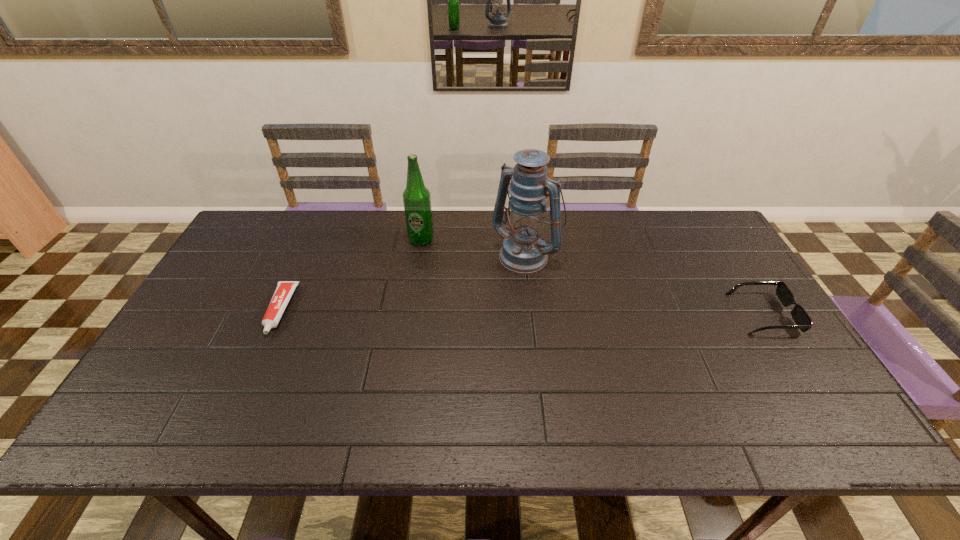
Image resolution: width=960 pixels, height=540 pixels. In order to click on vacant region between the third object from left to right and the third tallest object in this screenshot , I will do `click(645, 284)`.

Where is `vacant space in between the beer bottle and the leftmost object`? The width and height of the screenshot is (960, 540). vacant space in between the beer bottle and the leftmost object is located at coordinates (350, 275).

Find the location of `empty location between the third object from right to left and the rightmost object`. empty location between the third object from right to left and the rightmost object is located at coordinates (592, 276).

The width and height of the screenshot is (960, 540). In order to click on vacant area that lies between the third object from left to right and the third tallest object in this screenshot , I will do click(x=645, y=284).

Image resolution: width=960 pixels, height=540 pixels. I want to click on object that is the third closest to the third object from right to left, so click(x=803, y=321).

This screenshot has height=540, width=960. I want to click on object that is the third nearest to the leftmost object, so click(803, 321).

Where is `vacant area that satisfies the following two spatial constraints: 1. on the front side of the third object from left to right; 2. on the right side of the second object from left to right`? vacant area that satisfies the following two spatial constraints: 1. on the front side of the third object from left to right; 2. on the right side of the second object from left to right is located at coordinates (420, 253).

Identify the location of vacant space that satisfies the following two spatial constraints: 1. at the nozzle of the sunglasses; 2. on the front-facing side of the leftmost object. This screenshot has width=960, height=540. (278, 314).

Find the location of a particular element. Image resolution: width=960 pixels, height=540 pixels. vacant space that satisfies the following two spatial constraints: 1. at the nozzle of the second shortest object; 2. on the front-facing side of the leftmost object is located at coordinates (278, 314).

Where is `vacant space that satisfies the following two spatial constraints: 1. on the front side of the tallest object; 2. on the left side of the beer bottle`? vacant space that satisfies the following two spatial constraints: 1. on the front side of the tallest object; 2. on the left side of the beer bottle is located at coordinates (420, 253).